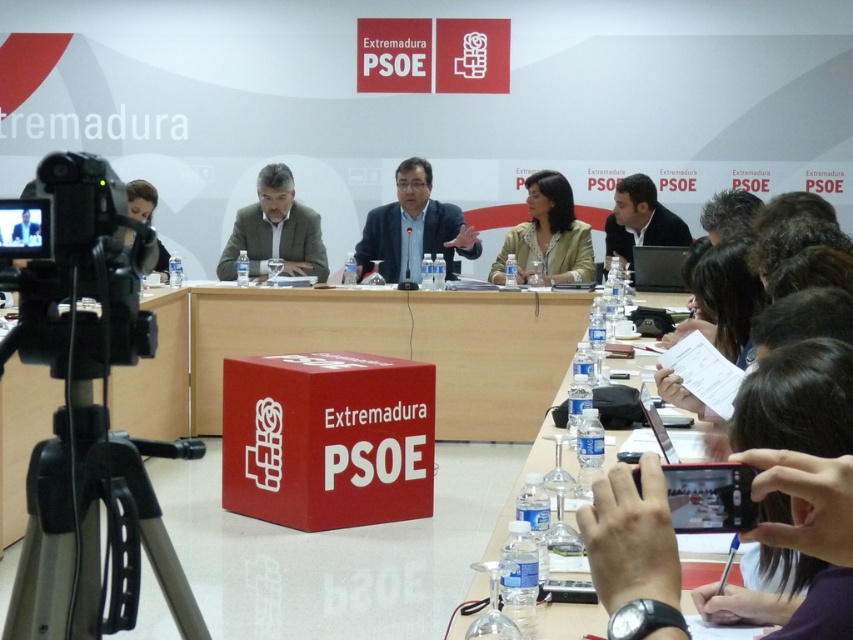
Is wooden table at center bigger than gray fabric suit at center?

Incorrect, wooden table at center is not larger than gray fabric suit at center.

How distant is wooden table at center from gray fabric suit at center?

wooden table at center is 5.13 feet away from gray fabric suit at center.

Is point (500, 333) in front of point (306, 268)?

That is True.

Identify the location of wooden table at center. (526, 321).

Is point (616, 248) farther from camera compared to point (163, 276)?

That is True.

Does matte black man at center lie behind matte black hair at upper left?

Yes, it is behind matte black hair at upper left.

You are a GUI agent. You are given a task and a screenshot of the screen. Output one action in this format:
    pyautogui.click(x=<x>, y=<y>)
    Task: Click on the matte black man at center
    This screenshot has width=853, height=640.
    Given the screenshot: What is the action you would take?
    tap(640, 220)

Which is behind, point (833, 634) or point (677, 218)?

Point (677, 218)

Measure the distance between black plastic phone at lower right and matte black man at center.

17.06 feet

Who is more forward, (642, 620) or (630, 230)?

Point (642, 620)

Locate an element on the screen. This screenshot has width=853, height=640. black plastic phone at lower right is located at coordinates (805, 472).